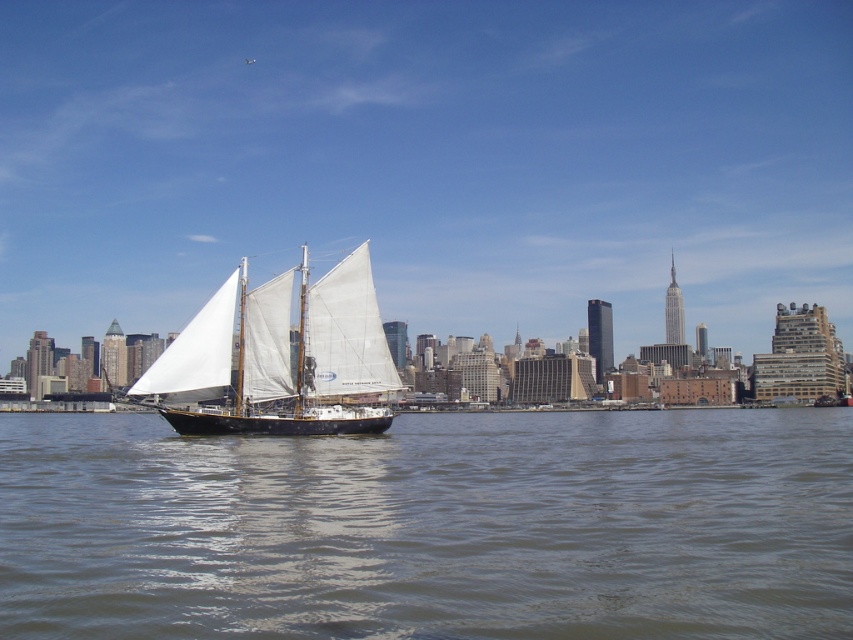
Can you confirm if brown water at center is positioned below white matte sailboat at center?

Indeed, brown water at center is positioned under white matte sailboat at center.

Is brown water at center wider than white matte sailboat at center?

Indeed, brown water at center has a greater width compared to white matte sailboat at center.

Where is `brown water at center`? This screenshot has width=853, height=640. brown water at center is located at coordinates (431, 528).

At what (x,y) coordinates should I click in order to perform the action: click on brown water at center. Please return your answer as a coordinate pair (x, y). Image resolution: width=853 pixels, height=640 pixels. Looking at the image, I should click on (431, 528).